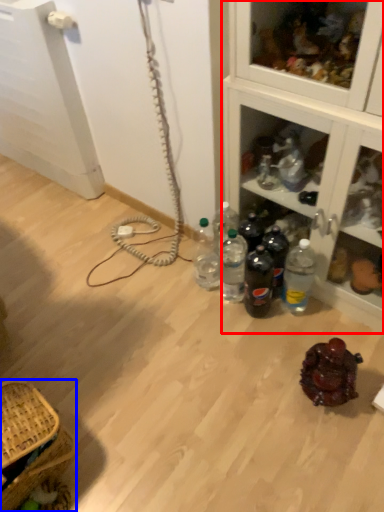
Question: Which of the following is the farthest to the observer, cabinetry (highlighted by a red box) or picnic basket (highlighted by a blue box)?

Choices:
 (A) cabinetry
 (B) picnic basket

Answer: (B)